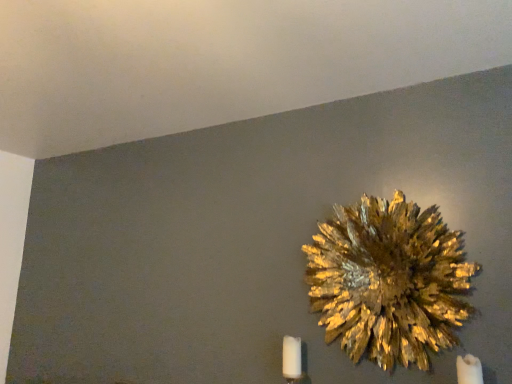
Question: Considering the positions of gold textured flower at upper right and white matte candle at lower right, arranged as the 2th candle when viewed from the left, in the image, is gold textured flower at upper right taller or shorter than white matte candle at lower right, arranged as the 2th candle when viewed from the left,?

Choices:
 (A) tall
 (B) short

Answer: (A)

Question: From a real-world perspective, relative to white matte candle at lower right, the second candle from the back, is gold textured flower at upper right vertically above or below?

Choices:
 (A) above
 (B) below

Answer: (A)

Question: Estimate the real-world distances between objects in this image. Which object is closer to the gold textured flower at upper right?

Choices:
 (A) white matte candle at lower right, the second candle from the back
 (B) white matte candle at lower right, positioned as the 1th candle in left-to-right order

Answer: (A)

Question: Considering the real-world distances, which object is closest to the white matte candle at lower right, the first candle in the front-to-back sequence?

Choices:
 (A) white matte candle at lower right, acting as the 1th candle starting from the back
 (B) gold textured flower at upper right

Answer: (B)